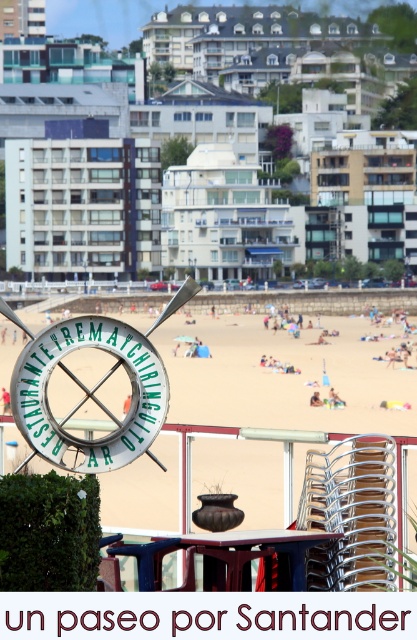
Question: Does beige sand at center have a lesser width compared to green metallic sign at center?

Choices:
 (A) no
 (B) yes

Answer: (A)

Question: Which of the following is the closest to the observer?

Choices:
 (A) beige sand at center
 (B) green metallic sign at center

Answer: (A)

Question: Is beige sand at center to the left of green metallic sign at center from the viewer's perspective?

Choices:
 (A) no
 (B) yes

Answer: (A)

Question: Does beige sand at center have a lesser width compared to green metallic sign at center?

Choices:
 (A) yes
 (B) no

Answer: (B)